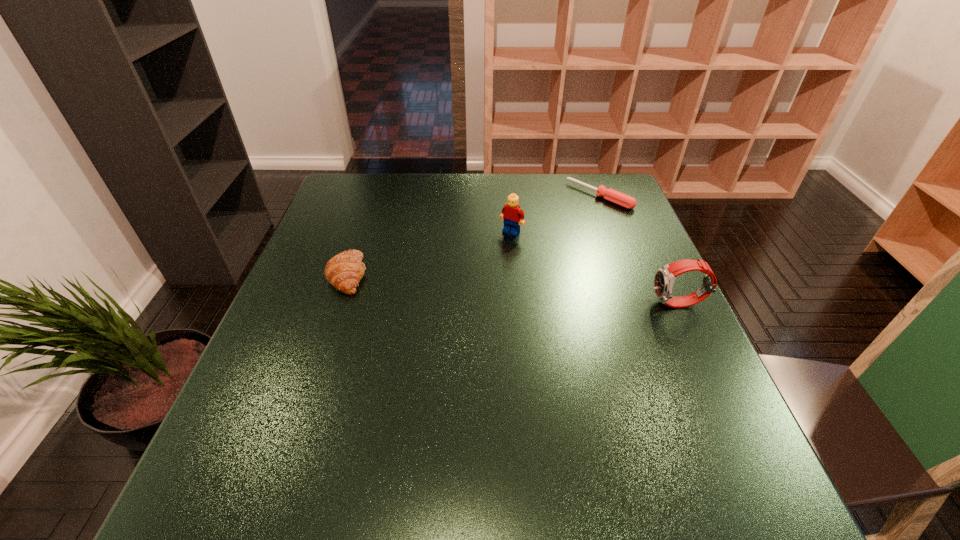
Locate an element on the screen. vacant area between the watch and the second object from left to right is located at coordinates (595, 268).

Where is `unoccupied area between the Lego and the third tallest object`? unoccupied area between the Lego and the third tallest object is located at coordinates (430, 253).

Locate an element on the screen. The image size is (960, 540). free space between the third nearest object and the second shortest object is located at coordinates (430, 253).

The width and height of the screenshot is (960, 540). What are the coordinates of `free spot between the watch and the third object from right to left` in the screenshot? It's located at (595, 268).

This screenshot has width=960, height=540. Identify the location of empty space that is in between the watch and the screwdriver. (639, 250).

Locate an element on the screen. This screenshot has height=540, width=960. free space between the farthest object and the third object from right to left is located at coordinates (556, 214).

The height and width of the screenshot is (540, 960). I want to click on vacant space in between the third tallest object and the shortest object, so (x=474, y=235).

Image resolution: width=960 pixels, height=540 pixels. In order to click on free space between the watch and the leftmost object in this screenshot , I will do `click(514, 289)`.

You are a GUI agent. You are given a task and a screenshot of the screen. Output one action in this format:
    pyautogui.click(x=<x>, y=<y>)
    Task: Click on the object that can be found as the third closest to the Lego
    The width and height of the screenshot is (960, 540).
    Given the screenshot: What is the action you would take?
    pyautogui.click(x=664, y=278)

Locate which object ranks third in proximity to the third object from right to left. Please provide its 2D coordinates. Your answer should be formatted as a tuple, i.e. [(x, y)], where the tuple contains the x and y coordinates of a point satisfying the conditions above.

[(664, 278)]